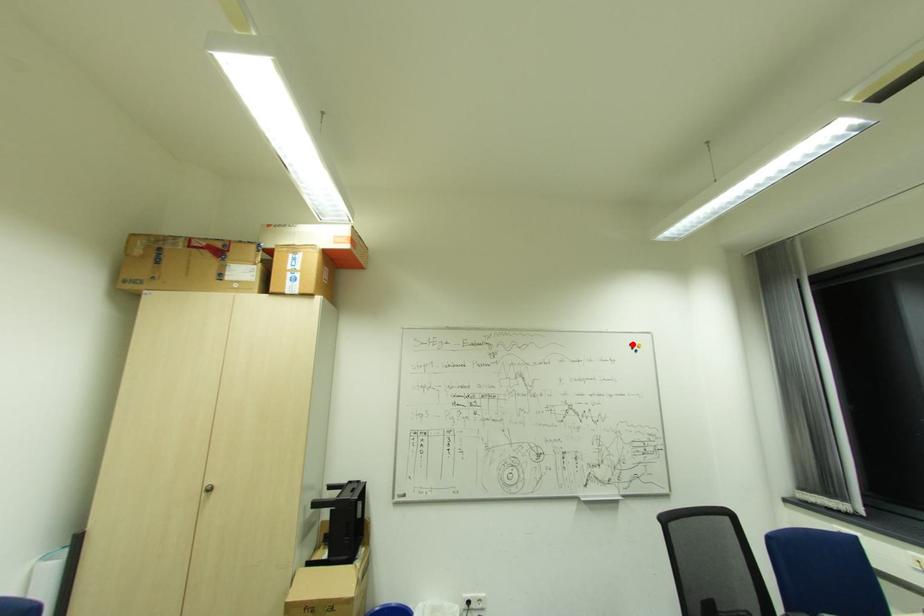
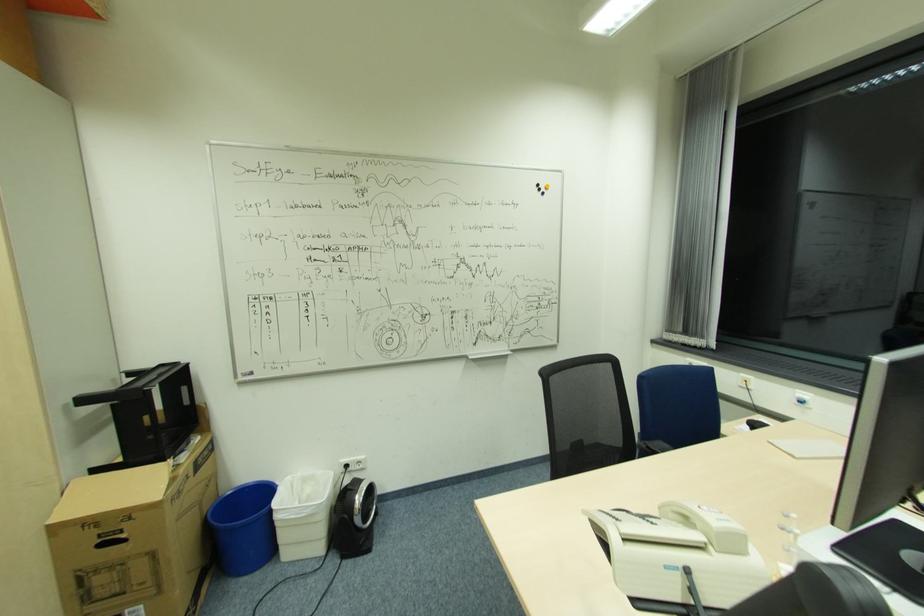
Question: A red point is marked in image1. In image2, is the corresponding 3D point closer to the camera or farther? Reply with the corresponding letter.

Choices:
 (A) The corresponding 3D point is closer.
 (B) The corresponding 3D point is farther.

Answer: (A)